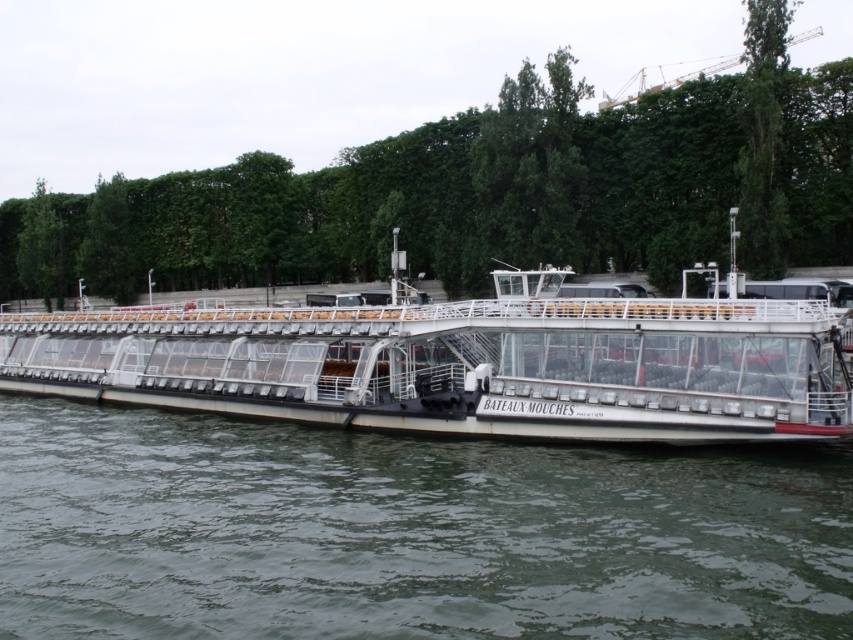
Which of these two, white glossy water at center or green leafy tree at center, stands shorter?

white glossy water at center

The height and width of the screenshot is (640, 853). I want to click on white glossy water at center, so click(405, 532).

The height and width of the screenshot is (640, 853). Find the location of `white glossy water at center`. white glossy water at center is located at coordinates (405, 532).

Between point (450, 516) and point (732, 248), which one is positioned in front?

Point (450, 516)

Between white glossy water at center and white matte boat at center, which one appears on the right side from the viewer's perspective?

Positioned to the right is white matte boat at center.

Who is more forward, (421,538) or (3,355)?

Positioned in front is point (421,538).

The image size is (853, 640). What are the coordinates of `white glossy water at center` in the screenshot? It's located at (405, 532).

Is point (26, 221) farther from viewer compared to point (321, 422)?

Yes, point (26, 221) is behind point (321, 422).

Is green leafy tree at center closer to camera compared to white matte boat at center?

No, it is behind white matte boat at center.

This screenshot has height=640, width=853. What do you see at coordinates (480, 193) in the screenshot?
I see `green leafy tree at center` at bounding box center [480, 193].

In order to click on green leafy tree at center in this screenshot , I will do `click(480, 193)`.